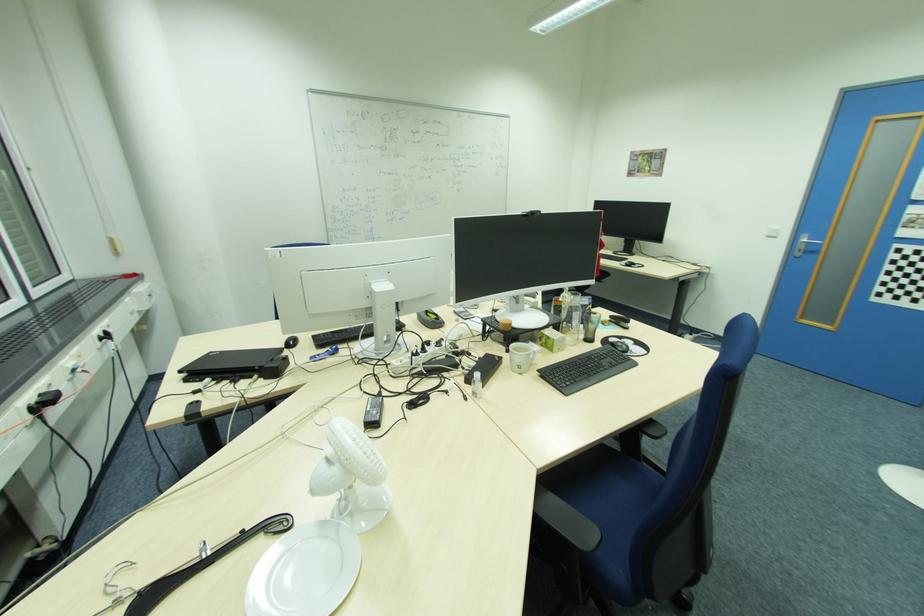
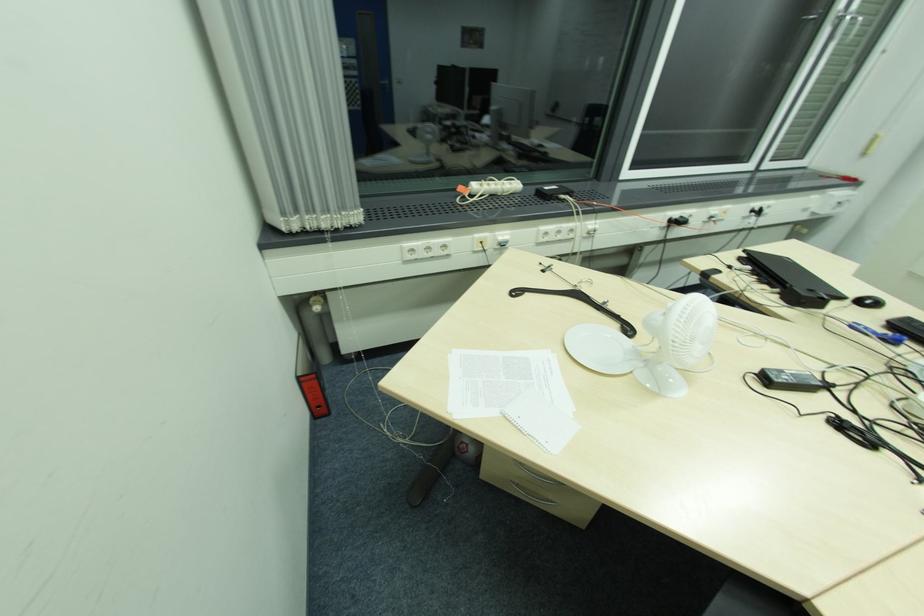
From the picture: The images are taken continuously from a first-person perspective. In which direction is your viewpoint rotating?

The rotation direction of the camera is left-down.